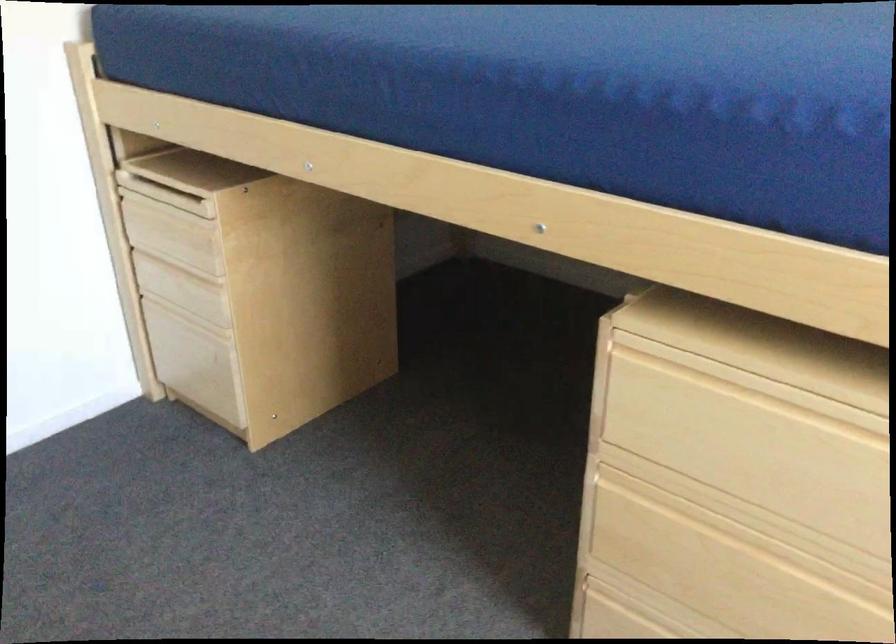
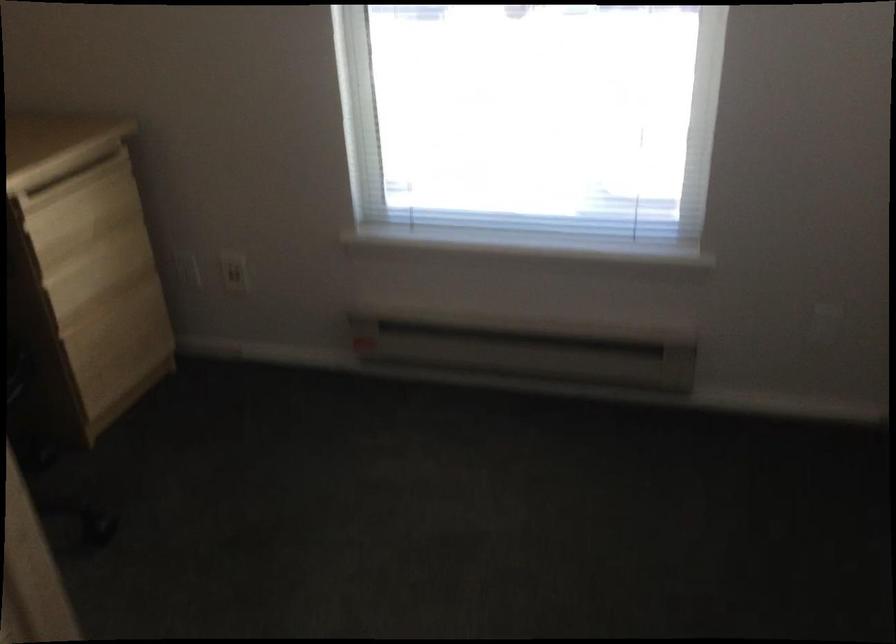
The images are taken continuously from a first-person perspective. In which direction is your viewpoint rotating?

The camera's rotation is toward right-down.